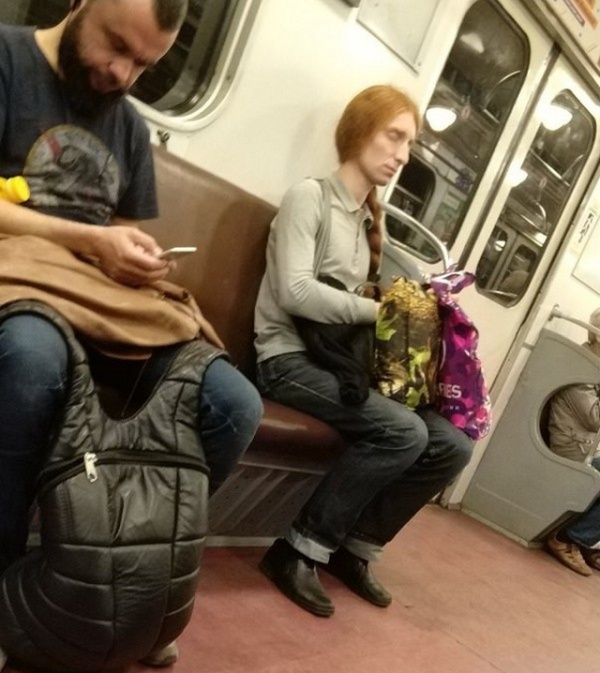
Locate an element on the screen. Image resolution: width=600 pixels, height=673 pixels. redish floor is located at coordinates (583, 595).